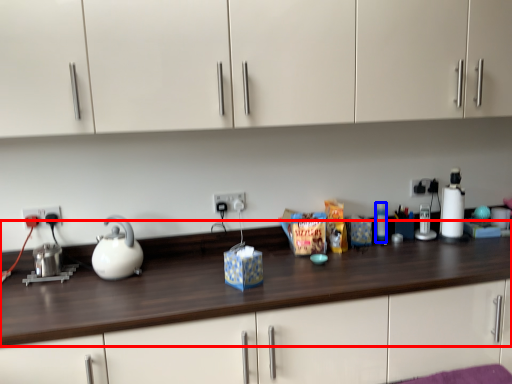
Question: Which point is further to the camera, counter top (highlighted by a red box) or bottle (highlighted by a blue box)?

Choices:
 (A) counter top
 (B) bottle

Answer: (B)